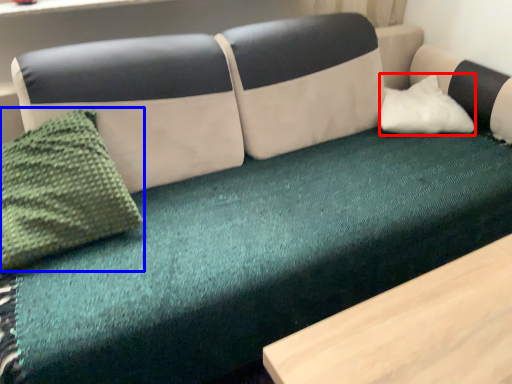
Question: Which point is further to the camera, pillow (highlighted by a red box) or throw pillow (highlighted by a blue box)?

Choices:
 (A) pillow
 (B) throw pillow

Answer: (A)